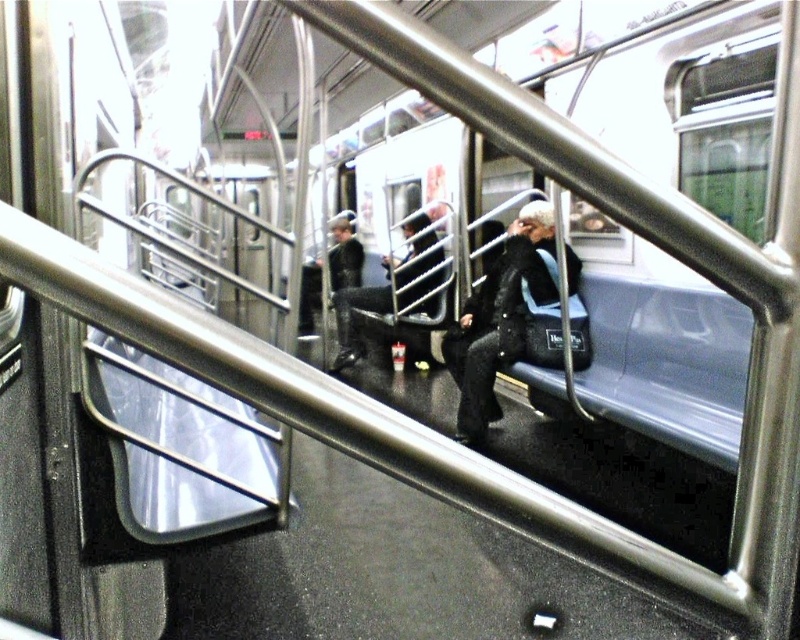
You are a passenger on the subway and need to decide which item to grab first if you want to pick up something from the floor near the center of the subway car. Which item is closer to the floor, the sparkly black coat at center or the black leather jacket at center?

The sparkly black coat at center is positioned under the black leather jacket at center, so the sparkly black coat at center is closer to the floor.